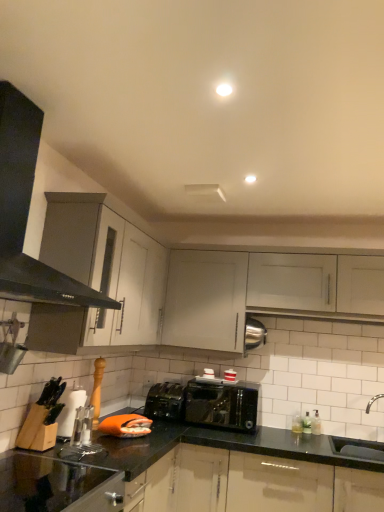
Question: From a real-world perspective, is white matte cabinet at upper center, which is counted as the first cabinetry, starting from the right, located higher than white ceramic sink at lower right, which appears as the second sink when ordered from the bottom?

Choices:
 (A) yes
 (B) no

Answer: (A)

Question: Could you tell me if white matte cabinet at upper center, the 2th cabinetry viewed from the left, is facing white ceramic sink at lower right, which appears as the first sink when viewed from the top?

Choices:
 (A) yes
 (B) no

Answer: (B)

Question: Is white matte cabinet at upper center, which is counted as the first cabinetry, starting from the right, taller than white ceramic sink at lower right, which appears as the first sink when viewed from the top?

Choices:
 (A) yes
 (B) no

Answer: (A)

Question: Is white matte cabinet at upper center, which is counted as the first cabinetry, starting from the right, far from white ceramic sink at lower right, which appears as the first sink when viewed from the top?

Choices:
 (A) no
 (B) yes

Answer: (B)

Question: Considering the relative positions of white matte cabinet at upper center, the 2th cabinetry viewed from the left, and white ceramic sink at lower right, which appears as the second sink when ordered from the bottom, in the image provided, is white matte cabinet at upper center, the 2th cabinetry viewed from the left, to the right of white ceramic sink at lower right, which appears as the second sink when ordered from the bottom, from the viewer's perspective?

Choices:
 (A) no
 (B) yes

Answer: (A)

Question: In the image, is black granite countertop at lower left positioned in front of or behind shiny black toaster at center?

Choices:
 (A) front
 (B) behind

Answer: (A)

Question: Based on their sizes in the image, would you say black granite countertop at lower left is bigger or smaller than shiny black toaster at center?

Choices:
 (A) small
 (B) big

Answer: (B)

Question: Is black granite countertop at lower left to the left or to the right of shiny black toaster at center in the image?

Choices:
 (A) left
 (B) right

Answer: (A)

Question: From a real-world perspective, is black granite countertop at lower left physically located above or below shiny black toaster at center?

Choices:
 (A) above
 (B) below

Answer: (B)

Question: Is black matte exhaust hood at left bigger or smaller than matte black toaster at center?

Choices:
 (A) big
 (B) small

Answer: (A)

Question: Is point pyautogui.click(x=21, y=221) closer or farther from the camera than point pyautogui.click(x=162, y=415)?

Choices:
 (A) closer
 (B) farther

Answer: (A)

Question: From the image's perspective, is black matte exhaust hood at left located above or below matte black toaster at center?

Choices:
 (A) below
 (B) above

Answer: (B)

Question: In the image, is black matte exhaust hood at left on the left side or the right side of matte black toaster at center?

Choices:
 (A) left
 (B) right

Answer: (A)

Question: Is white ceramic sink at lower right, which appears as the first sink when viewed from the top, wider or thinner than matte black toaster at center?

Choices:
 (A) thin
 (B) wide

Answer: (B)

Question: Is white ceramic sink at lower right, which appears as the first sink when viewed from the top, inside the boundaries of matte black toaster at center, or outside?

Choices:
 (A) outside
 (B) inside

Answer: (A)